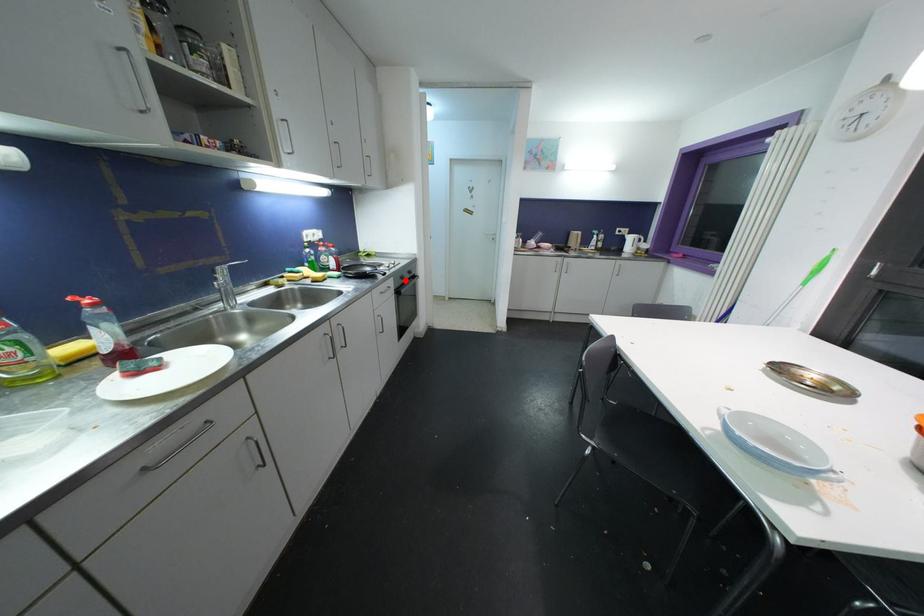
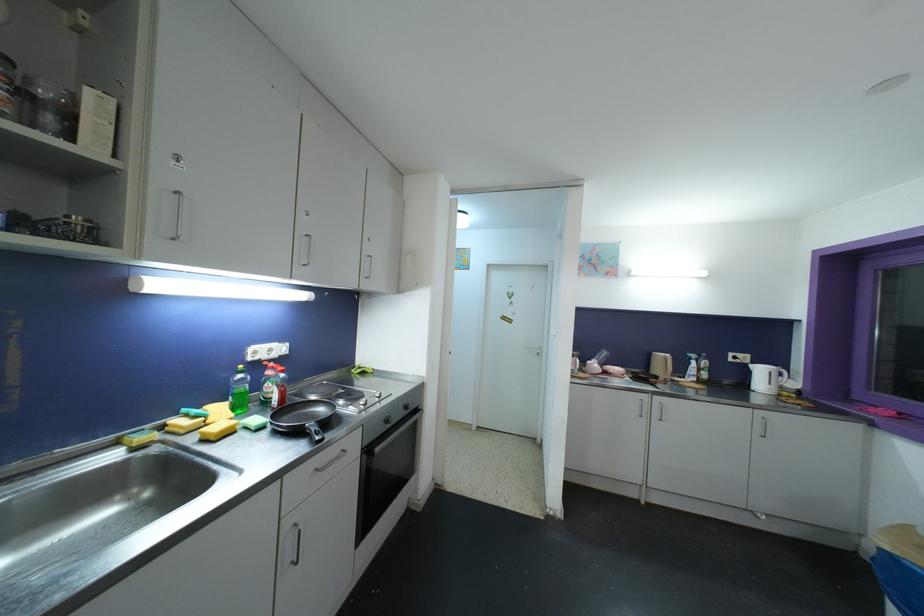
Question: I am providing you with two images of the same scene from different viewpoints. Image1 has a red point marked. In image2, the corresponding 3D location appears at what relative position? Reply with the corresponding letter.

Choices:
 (A) Closer
 (B) Farther

Answer: (B)